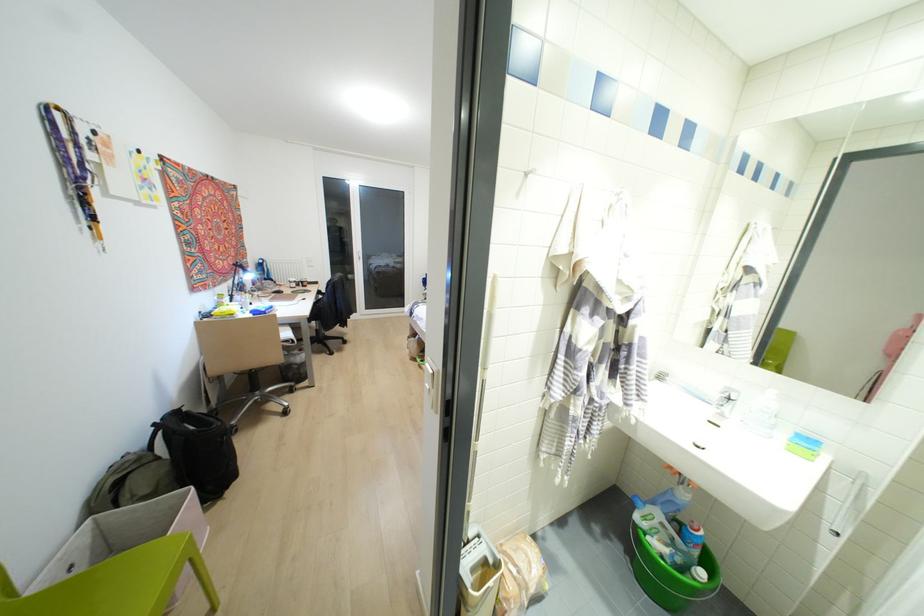
Image resolution: width=924 pixels, height=616 pixels. What do you see at coordinates (849, 506) in the screenshot?
I see `a balcony door handle` at bounding box center [849, 506].